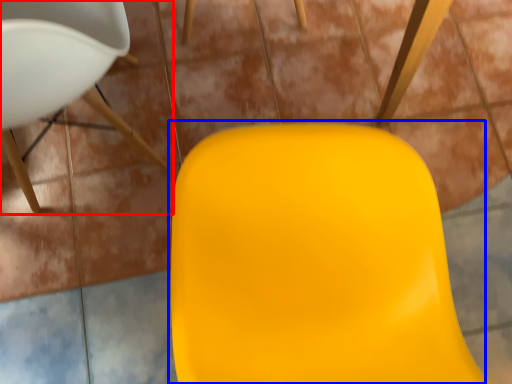
Question: Among these objects, which one is nearest to the camera, chair (highlighted by a red box) or swivel chair (highlighted by a blue box)?

Choices:
 (A) chair
 (B) swivel chair

Answer: (B)